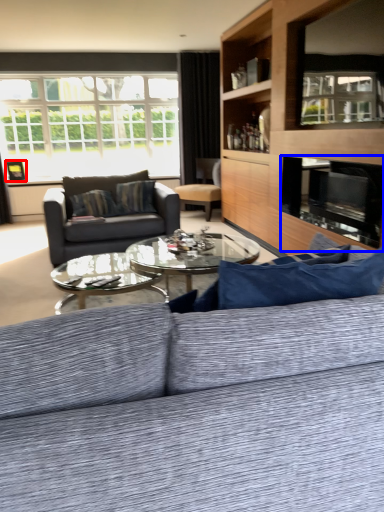
Question: Which object appears closest to the camera in this image, picture frame (highlighted by a red box) or fireplace (highlighted by a blue box)?

Choices:
 (A) picture frame
 (B) fireplace

Answer: (B)